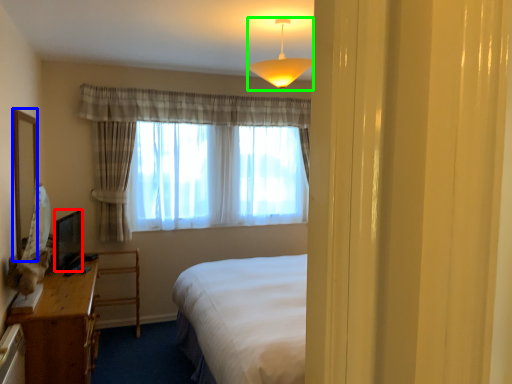
Question: Which is farther away from television (highlighted by a red box)? mirror (highlighted by a blue box) or lamp (highlighted by a green box)?

Choices:
 (A) mirror
 (B) lamp

Answer: (B)